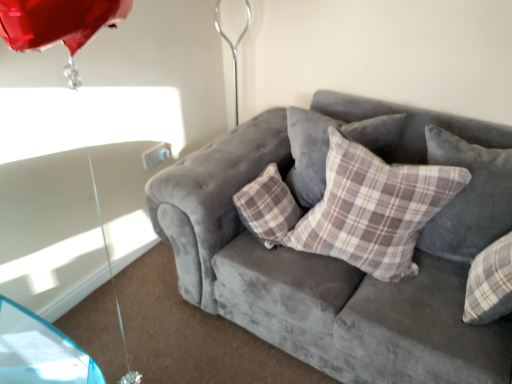
Question: Is plaid fabric pillow at center, which appears as the second pillow when viewed from the right, looking in the opposite direction of plaid fabric pillow at center, acting as the third pillow starting from the right?

Choices:
 (A) no
 (B) yes

Answer: (B)

Question: From the image's perspective, would you say plaid fabric pillow at center, arranged as the second pillow when viewed from the left, is shown under plaid fabric pillow at center, acting as the third pillow starting from the right?

Choices:
 (A) yes
 (B) no

Answer: (A)

Question: Considering the relative sizes of plaid fabric pillow at center, which appears as the second pillow when viewed from the right, and plaid fabric pillow at center, acting as the 1th pillow starting from the left, in the image provided, is plaid fabric pillow at center, which appears as the second pillow when viewed from the right, smaller than plaid fabric pillow at center, acting as the 1th pillow starting from the left,?

Choices:
 (A) no
 (B) yes

Answer: (A)

Question: Is plaid fabric pillow at center, arranged as the second pillow when viewed from the left, taller than plaid fabric pillow at center, acting as the third pillow starting from the right?

Choices:
 (A) no
 (B) yes

Answer: (B)

Question: Can plaid fabric pillow at center, acting as the 1th pillow starting from the left, be found inside plaid fabric pillow at center, which appears as the second pillow when viewed from the right?

Choices:
 (A) yes
 (B) no

Answer: (B)

Question: Considering the relative sizes of plaid fabric pillow at center, which appears as the second pillow when viewed from the right, and plaid fabric pillow at center, acting as the third pillow starting from the right, in the image provided, is plaid fabric pillow at center, which appears as the second pillow when viewed from the right, shorter than plaid fabric pillow at center, acting as the third pillow starting from the right,?

Choices:
 (A) no
 (B) yes

Answer: (A)

Question: Considering the relative sizes of plaid fabric pillow at center, which is the 3th pillow in left-to-right order, and plaid fabric pillow at center, acting as the 1th pillow starting from the left, in the image provided, is plaid fabric pillow at center, which is the 3th pillow in left-to-right order, thinner than plaid fabric pillow at center, acting as the 1th pillow starting from the left,?

Choices:
 (A) yes
 (B) no

Answer: (B)

Question: From a real-world perspective, is plaid fabric pillow at center, which is the 3th pillow in left-to-right order, positioned over plaid fabric pillow at center, acting as the 1th pillow starting from the left, based on gravity?

Choices:
 (A) yes
 (B) no

Answer: (A)

Question: From the image's perspective, is plaid fabric pillow at center, which is the 3th pillow in left-to-right order, located above plaid fabric pillow at center, acting as the third pillow starting from the right?

Choices:
 (A) yes
 (B) no

Answer: (B)

Question: Is plaid fabric pillow at center, the first pillow from the right, far from plaid fabric pillow at center, acting as the 1th pillow starting from the left?

Choices:
 (A) no
 (B) yes

Answer: (A)

Question: Could you tell me if plaid fabric pillow at center, which is the 3th pillow in left-to-right order, is facing plaid fabric pillow at center, acting as the third pillow starting from the right?

Choices:
 (A) no
 (B) yes

Answer: (A)

Question: Does plaid fabric pillow at center, which is the 3th pillow in left-to-right order, lie behind plaid fabric pillow at center, acting as the third pillow starting from the right?

Choices:
 (A) yes
 (B) no

Answer: (B)

Question: Considering the relative sizes of velvet gray couch at center and plaid fabric pillow at center, acting as the third pillow starting from the right, in the image provided, is velvet gray couch at center smaller than plaid fabric pillow at center, acting as the third pillow starting from the right,?

Choices:
 (A) no
 (B) yes

Answer: (A)